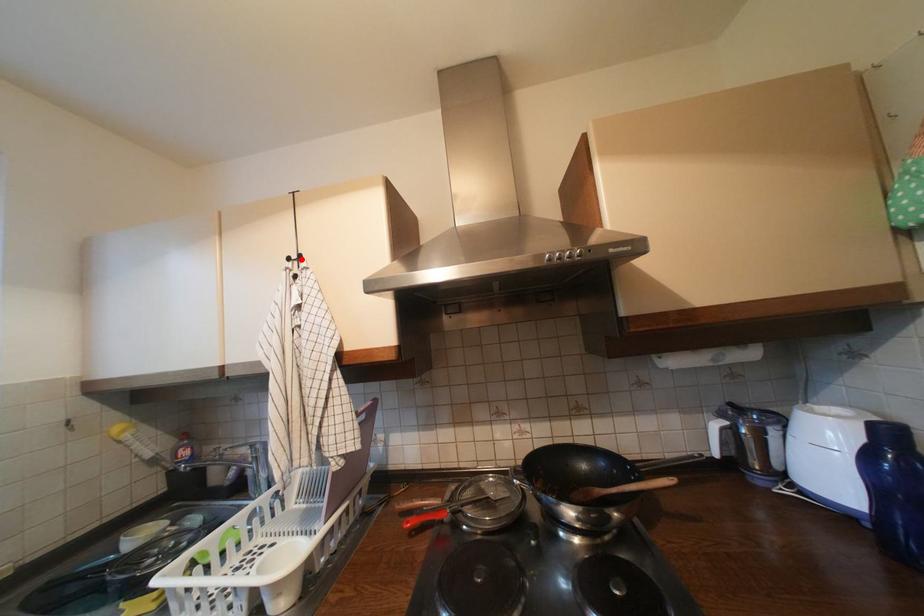
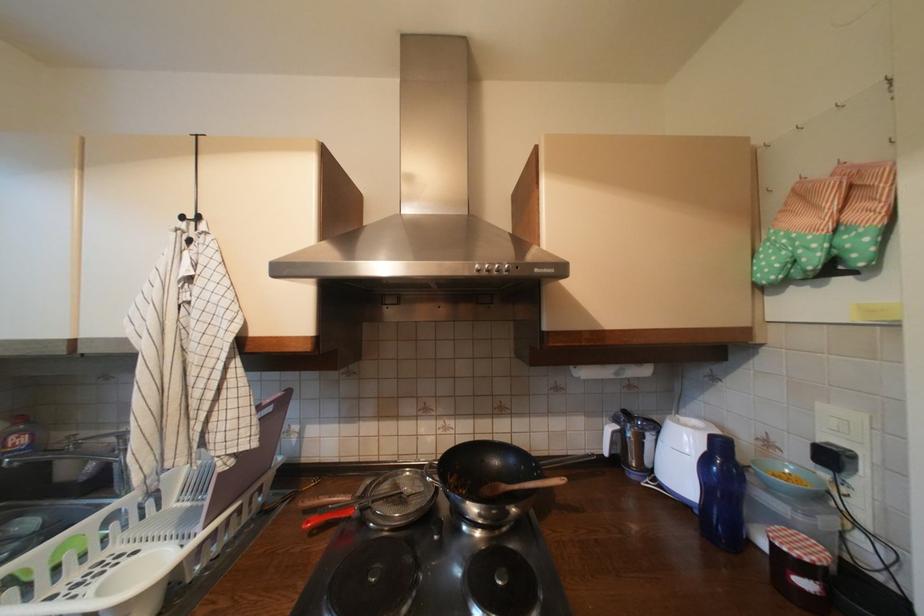
Locate, in the second image, the point that corresponds to the highlighted location in the first image.

(197, 219)